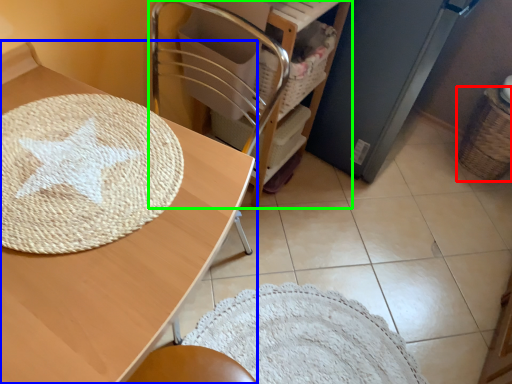
Question: Which object is the closest to the basket (highlighted by a red box)? Choose among these: table (highlighted by a blue box) or furniture (highlighted by a green box).

Choices:
 (A) table
 (B) furniture

Answer: (B)